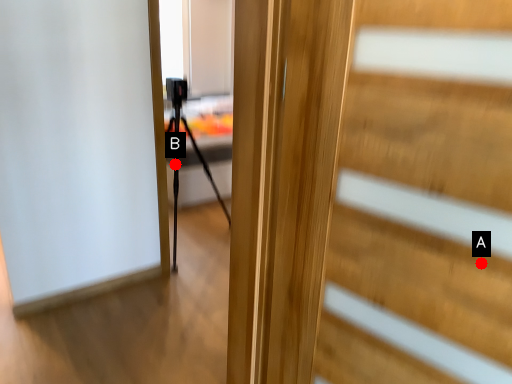
Question: Two points are circled on the image, labeled by A and B beside each circle. Which point is closer to the camera?

Choices:
 (A) A is closer
 (B) B is closer

Answer: (A)